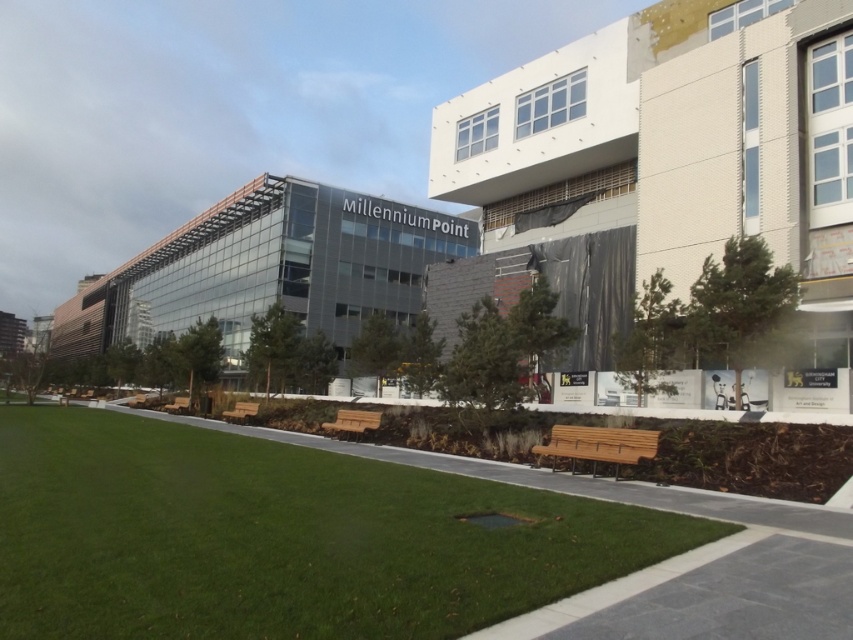
You are standing at the entrance of Millennium Point and want to sit down. You see a wooden bench at lower right. Is the point at coordinates point (598, 445) on that bench?

Yes, the point (598, 445) is on the wooden bench at lower right, so you can sit there.

You are planning to host a small gathering in the Millennium Point area and need seating for 10 people. Given the wooden park bench at center and the wooden bench at lower left, which bench can accommodate more people?

The wooden bench at lower left can accommodate more people since it is larger than the wooden park bench at center according to the description.